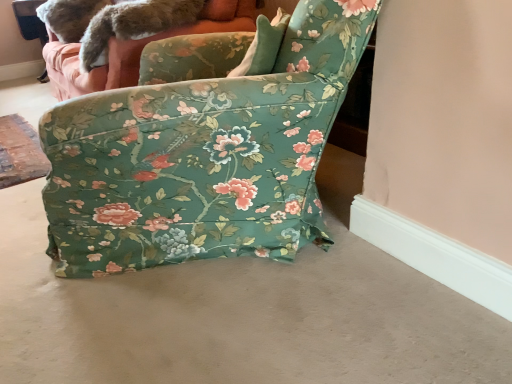
Question: Considering the relative sizes of fuzzy fur tail at upper left and floral fabric chair at center in the image provided, is fuzzy fur tail at upper left bigger than floral fabric chair at center?

Choices:
 (A) no
 (B) yes

Answer: (A)

Question: Considering the relative sizes of fuzzy fur tail at upper left and floral fabric chair at center in the image provided, is fuzzy fur tail at upper left shorter than floral fabric chair at center?

Choices:
 (A) no
 (B) yes

Answer: (B)

Question: From a real-world perspective, does fuzzy fur tail at upper left stand above floral fabric chair at center?

Choices:
 (A) no
 (B) yes

Answer: (B)

Question: From the image's perspective, is fuzzy fur tail at upper left on floral fabric chair at center?

Choices:
 (A) yes
 (B) no

Answer: (A)

Question: Are fuzzy fur tail at upper left and floral fabric chair at center located far from each other?

Choices:
 (A) no
 (B) yes

Answer: (B)

Question: From a real-world perspective, is fuzzy fur tail at upper left beneath floral fabric chair at center?

Choices:
 (A) yes
 (B) no

Answer: (B)

Question: Is floral fabric couch at upper center taller than floral fabric chair at center?

Choices:
 (A) no
 (B) yes

Answer: (A)

Question: Is floral fabric chair at center located within floral fabric couch at upper center?

Choices:
 (A) yes
 (B) no

Answer: (B)

Question: Considering the relative sizes of floral fabric couch at upper center and floral fabric chair at center in the image provided, is floral fabric couch at upper center smaller than floral fabric chair at center?

Choices:
 (A) no
 (B) yes

Answer: (A)

Question: Is floral fabric couch at upper center not inside floral fabric chair at center?

Choices:
 (A) no
 (B) yes

Answer: (B)

Question: Is floral fabric couch at upper center in front of floral fabric chair at center?

Choices:
 (A) yes
 (B) no

Answer: (B)

Question: Is floral fabric couch at upper center facing towards floral fabric chair at center?

Choices:
 (A) no
 (B) yes

Answer: (A)

Question: From the image's perspective, is floral fabric couch at upper center under fuzzy fur tail at upper left?

Choices:
 (A) no
 (B) yes

Answer: (A)